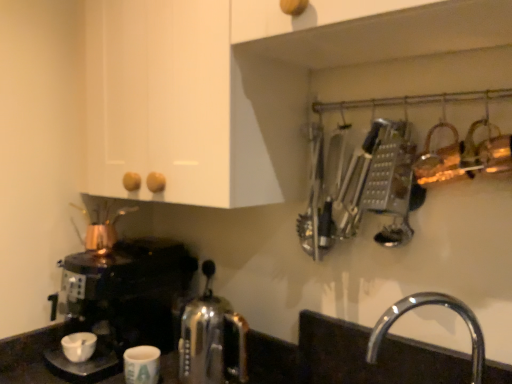
Question: From a real-world perspective, is shiny black coffee maker at left physically above copper metallic tea pot at left?

Choices:
 (A) no
 (B) yes

Answer: (A)

Question: Is the position of shiny black coffee maker at left more distant than that of copper metallic tea pot at left?

Choices:
 (A) no
 (B) yes

Answer: (A)

Question: Considering the relative sizes of shiny black coffee maker at left and copper metallic tea pot at left in the image provided, is shiny black coffee maker at left shorter than copper metallic tea pot at left?

Choices:
 (A) yes
 (B) no

Answer: (B)

Question: Could copper metallic tea pot at left be considered to be inside shiny black coffee maker at left?

Choices:
 (A) no
 (B) yes

Answer: (A)

Question: Can you confirm if shiny black coffee maker at left is wider than copper metallic tea pot at left?

Choices:
 (A) yes
 (B) no

Answer: (A)

Question: Is shiny black coffee maker at left closer to camera compared to copper metallic tea pot at left?

Choices:
 (A) no
 (B) yes

Answer: (B)

Question: Considering the relative sizes of white matte coffee cup at lower center, the second coffee cup in the left-to-right sequence, and metallic silver grater at upper right in the image provided, is white matte coffee cup at lower center, the second coffee cup in the left-to-right sequence, wider than metallic silver grater at upper right?

Choices:
 (A) yes
 (B) no

Answer: (B)

Question: From a real-world perspective, is white matte coffee cup at lower center, the second coffee cup in the left-to-right sequence, located beneath metallic silver grater at upper right?

Choices:
 (A) yes
 (B) no

Answer: (A)

Question: Is white matte coffee cup at lower center, the second coffee cup in the left-to-right sequence, not inside metallic silver grater at upper right?

Choices:
 (A) no
 (B) yes

Answer: (B)

Question: Is white matte coffee cup at lower center, the second coffee cup in the left-to-right sequence, smaller than metallic silver grater at upper right?

Choices:
 (A) yes
 (B) no

Answer: (A)

Question: Could metallic silver grater at upper right be considered to be inside white matte coffee cup at lower center, arranged as the 1th coffee cup when viewed from the right?

Choices:
 (A) yes
 (B) no

Answer: (B)

Question: Considering the relative sizes of white matte coffee cup at lower center, the second coffee cup in the left-to-right sequence, and metallic silver grater at upper right in the image provided, is white matte coffee cup at lower center, the second coffee cup in the left-to-right sequence, bigger than metallic silver grater at upper right?

Choices:
 (A) yes
 (B) no

Answer: (B)

Question: Is chrome/metallic faucet at lower right turned away from metallic silver grater at upper right?

Choices:
 (A) yes
 (B) no

Answer: (B)